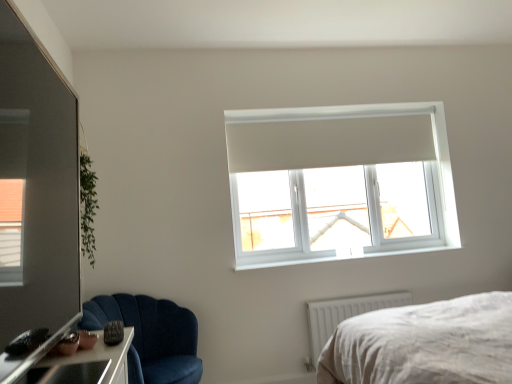
Question: From the image's perspective, is velvet blue chair at lower left located beneath transparent glass door at left?

Choices:
 (A) yes
 (B) no

Answer: (A)

Question: Could transparent glass door at left be considered to be inside velvet blue chair at lower left?

Choices:
 (A) yes
 (B) no

Answer: (B)

Question: Does velvet blue chair at lower left have a lesser height compared to transparent glass door at left?

Choices:
 (A) no
 (B) yes

Answer: (A)

Question: Is velvet blue chair at lower left in front of transparent glass door at left?

Choices:
 (A) yes
 (B) no

Answer: (B)

Question: Is velvet blue chair at lower left bigger than transparent glass door at left?

Choices:
 (A) yes
 (B) no

Answer: (A)

Question: From the image's perspective, would you say velvet blue chair at lower left is positioned over transparent glass door at left?

Choices:
 (A) yes
 (B) no

Answer: (B)

Question: Is white plastic window sill at upper center wider than velvet blue chair at lower left?

Choices:
 (A) yes
 (B) no

Answer: (B)

Question: Is white plastic window sill at upper center at the right side of velvet blue chair at lower left?

Choices:
 (A) no
 (B) yes

Answer: (B)

Question: Can you confirm if white plastic window sill at upper center is shorter than velvet blue chair at lower left?

Choices:
 (A) yes
 (B) no

Answer: (A)

Question: From a real-world perspective, is white plastic window sill at upper center beneath velvet blue chair at lower left?

Choices:
 (A) yes
 (B) no

Answer: (B)

Question: Is white plastic window sill at upper center touching velvet blue chair at lower left?

Choices:
 (A) no
 (B) yes

Answer: (A)

Question: Can you confirm if white plastic window sill at upper center is taller than velvet blue chair at lower left?

Choices:
 (A) yes
 (B) no

Answer: (B)

Question: From the image's perspective, is white plastic window sill at upper center over transparent glass door at left?

Choices:
 (A) no
 (B) yes

Answer: (A)